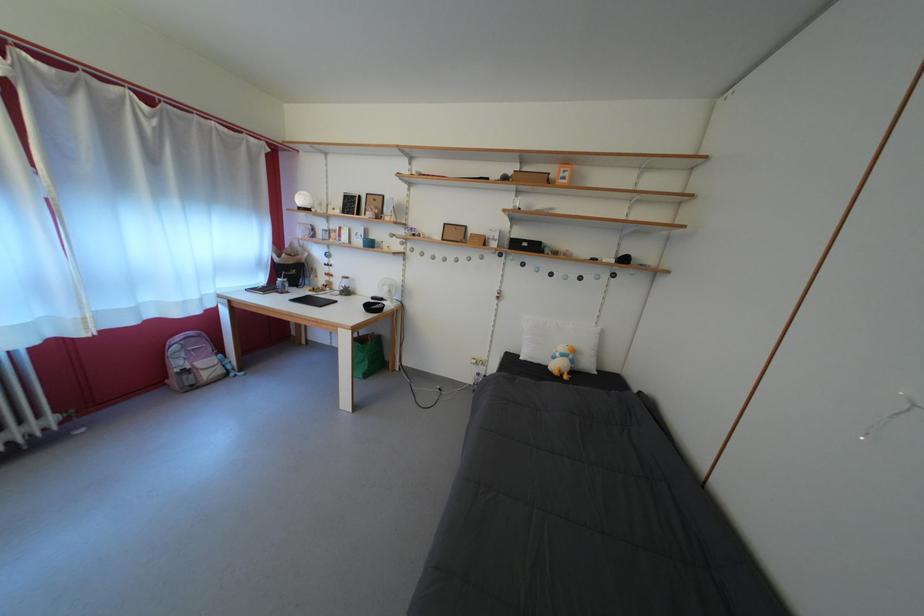
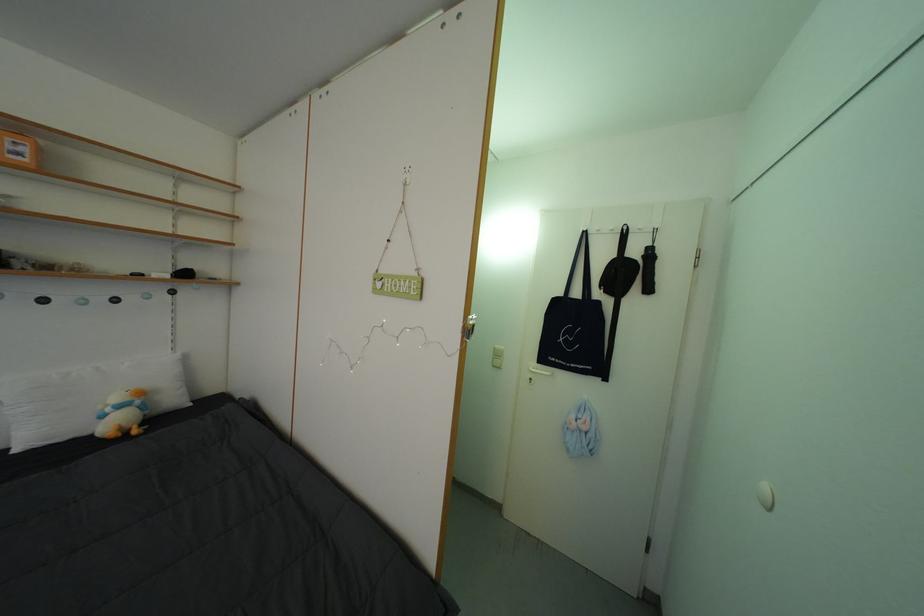
Question: Based on the continuous images, in which direction is the camera rotating? Reply with the corresponding letter.

Choices:
 (A) Left
 (B) Right
 (C) Up
 (D) Down

Answer: (B)